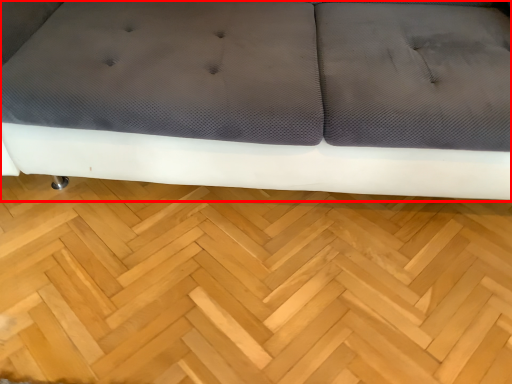
Question: From the image's perspective, what is the correct spatial positioning of studio couch (annotated by the red box) in reference to hardwood?

Choices:
 (A) below
 (B) above

Answer: (B)